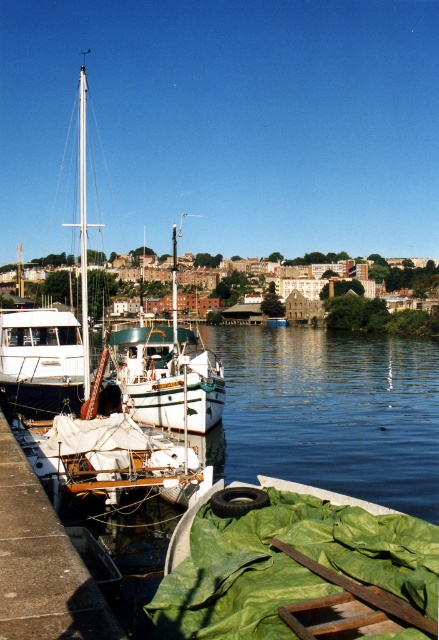
Question: Which point is farther from the camera taking this photo?

Choices:
 (A) (123, 368)
 (B) (85, 292)
 (C) (115, 333)
 (D) (71, 634)

Answer: (C)

Question: Does white matte sailboat at left appear on the right side of white glossy mast at left?

Choices:
 (A) no
 (B) yes

Answer: (B)

Question: Can you confirm if concrete dock at lower left is positioned below white matte boat at left?

Choices:
 (A) no
 (B) yes

Answer: (B)

Question: Estimate the real-world distances between objects in this image. Which object is closer to the white matte boat at left?

Choices:
 (A) white matte sailboat at left
 (B) white matte boat at center

Answer: (B)

Question: Which object is the closest to the concrete dock at lower left?

Choices:
 (A) white glossy mast at left
 (B) white matte boat at center

Answer: (B)

Question: Can you confirm if white matte boat at center is positioned to the right of white matte boat at left?

Choices:
 (A) yes
 (B) no

Answer: (A)